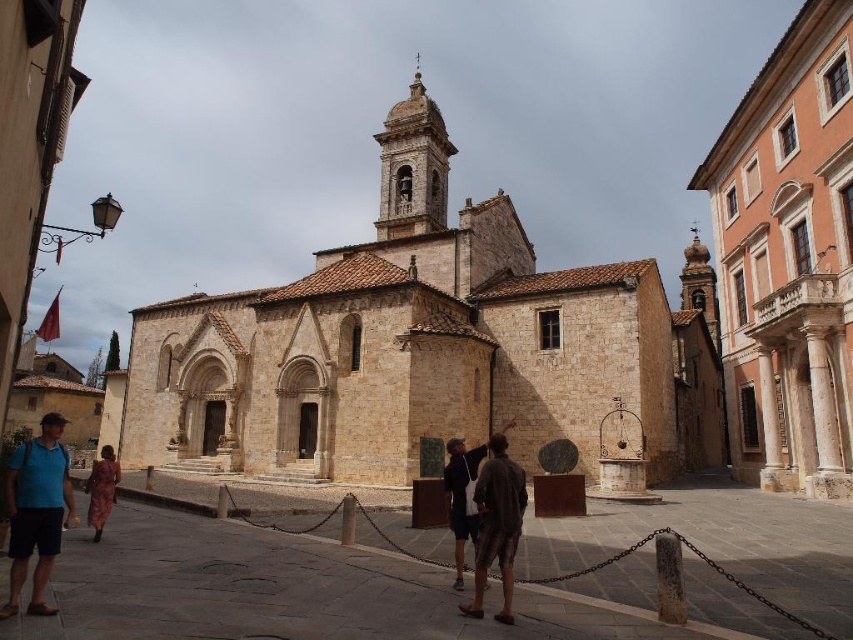
Question: Is blue fabric shirt at lower left below brown textured clothing at center?

Choices:
 (A) no
 (B) yes

Answer: (B)

Question: Among these objects, which one is farthest from the camera?

Choices:
 (A) beige stone church at center
 (B) brown textured clothing at center
 (C) light orange stone building at right
 (D) blue fabric shirt at lower left

Answer: (A)

Question: Is the position of beige stone church at center less distant than that of light orange stone building at right?

Choices:
 (A) yes
 (B) no

Answer: (B)

Question: Which object is the farthest from the leather coat at lower left?

Choices:
 (A) beige stone church at center
 (B) brown textured clothing at center
 (C) blue fabric shirt at lower left

Answer: (A)

Question: Which of the following is the closest to the observer?

Choices:
 (A) leather coat at lower left
 (B) beige stone church at center
 (C) light orange stone building at right
 (D) blue fabric shirt at lower left

Answer: (D)

Question: Does beige stone church at center have a larger size compared to blue fabric shirt at lower left?

Choices:
 (A) no
 (B) yes

Answer: (B)